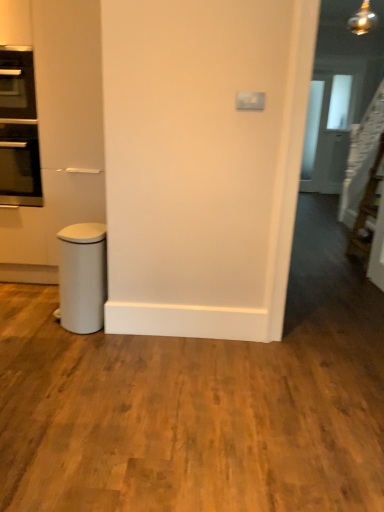
Question: From the image's perspective, relative to white matte waste bin at lower left, is transparent glass door at upper right above or below?

Choices:
 (A) below
 (B) above

Answer: (B)

Question: Is transparent glass door at upper right to the left or to the right of white matte waste bin at lower left in the image?

Choices:
 (A) left
 (B) right

Answer: (B)

Question: Based on their relative distances, which object is farther from the black glass oven at left?

Choices:
 (A) white matte waste bin at lower left
 (B) transparent glass door at upper right

Answer: (B)

Question: Which of these objects is positioned closest to the transparent glass door at upper right?

Choices:
 (A) white matte waste bin at lower left
 (B) black glass oven at left

Answer: (B)